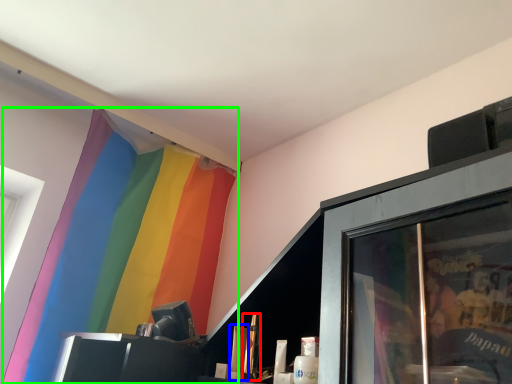
Question: Which object is positioned farthest from toiletry (highlighted by a red box)? Select from toiletry (highlighted by a blue box) and curtain (highlighted by a green box).

Choices:
 (A) toiletry
 (B) curtain

Answer: (B)